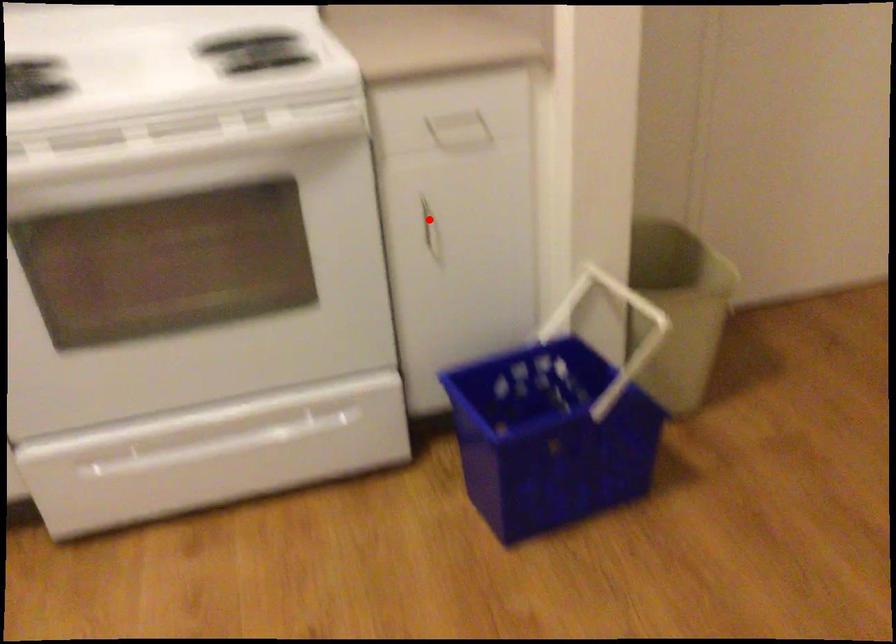
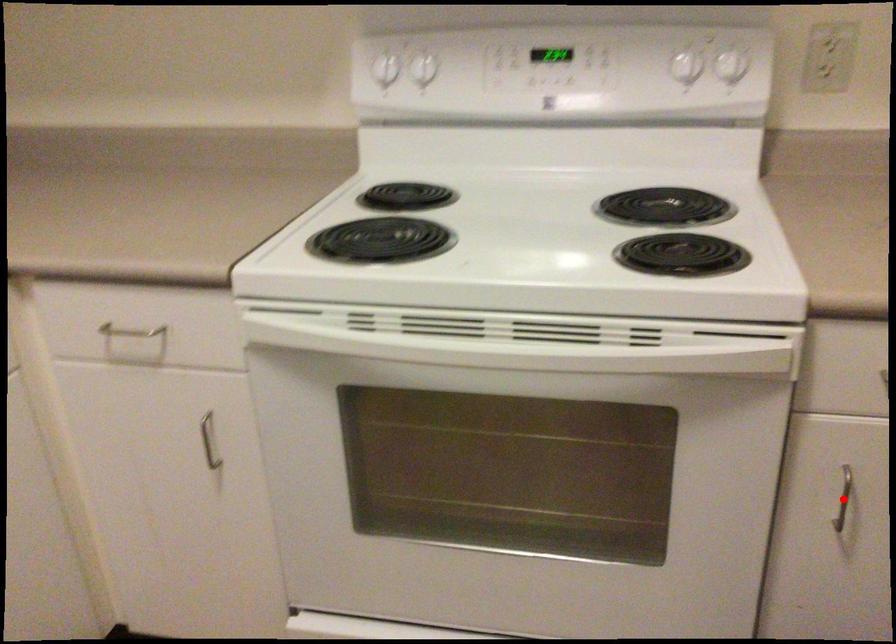
I am providing you with two images of the same scene from different viewpoints. A red point is marked on the first image and another point is marked on the second image. Does the point marked in image1 correspond to the same location as the one in image2?

Yes